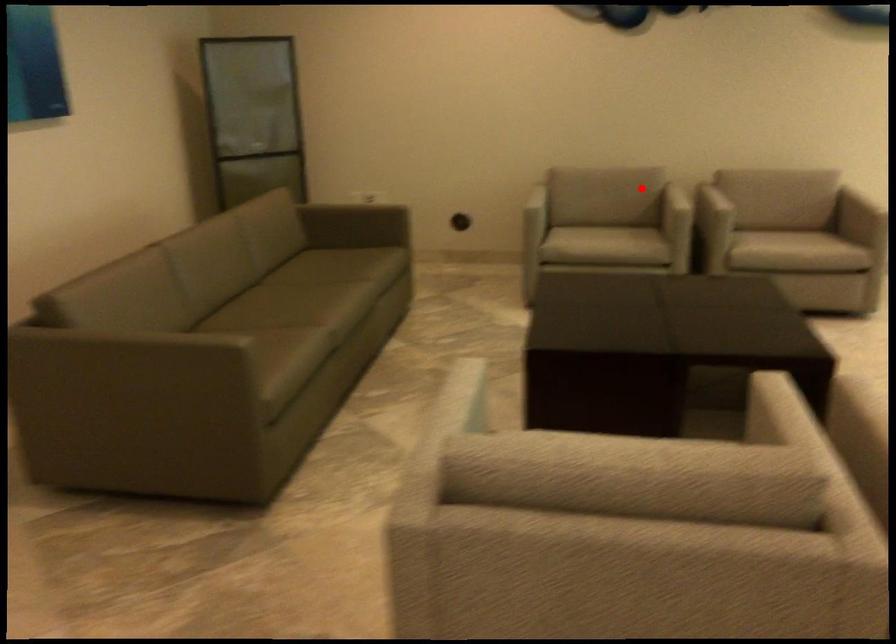
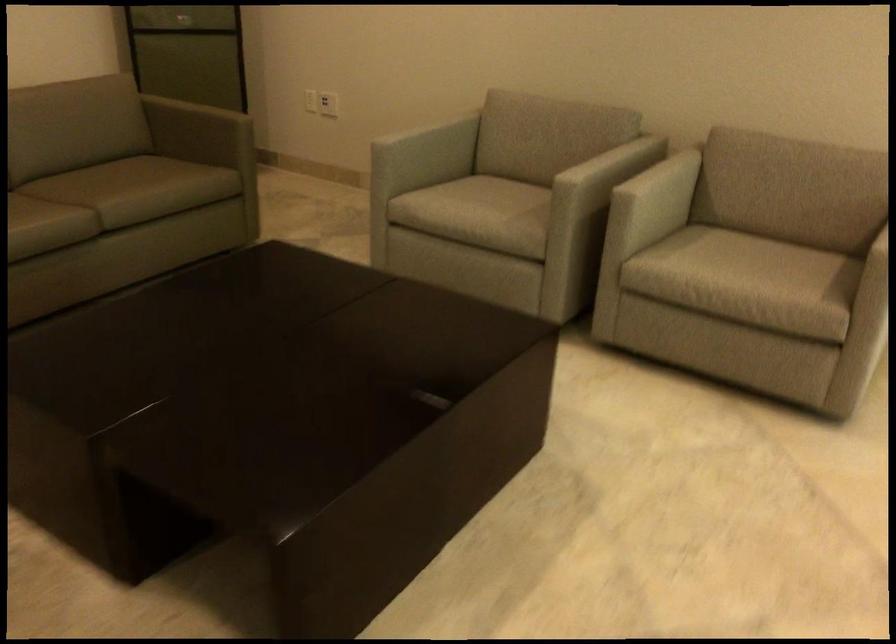
In the second image, find the point that corresponds to the highlighted location in the first image.

(588, 149)